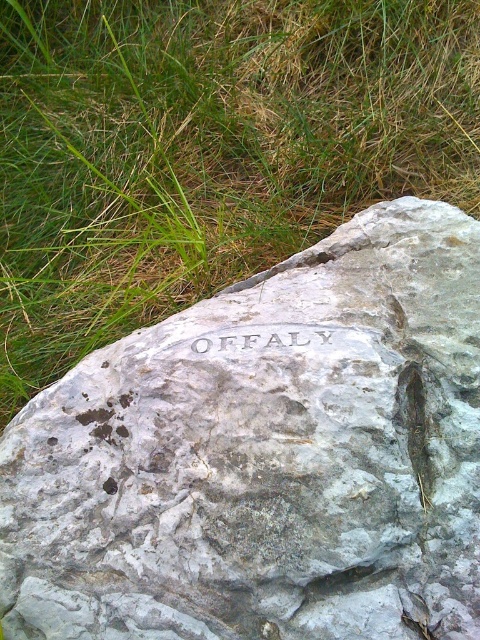
Does gray stone boulder at center appear on the right side of green grass at upper left?

Yes, gray stone boulder at center is to the right of green grass at upper left.

Looking at this image, how much distance is there between gray stone boulder at center and green grass at upper left?

gray stone boulder at center and green grass at upper left are 23.72 inches apart from each other.

The height and width of the screenshot is (640, 480). What are the coordinates of `gray stone boulder at center` in the screenshot? It's located at (265, 458).

Does green grass at upper left have a smaller size compared to gray stone engraving at center?

Actually, green grass at upper left might be larger than gray stone engraving at center.

Which of these two, green grass at upper left or gray stone engraving at center, stands taller?

green grass at upper left is taller.

Does point (22, 179) come behind point (267, 337)?

Yes, it is.

Where is `green grass at upper left`? This screenshot has width=480, height=640. green grass at upper left is located at coordinates (206, 148).

Does gray stone boulder at center lie behind gray stone engraving at center?

No.

Does gray stone boulder at center have a smaller size compared to gray stone engraving at center?

Actually, gray stone boulder at center might be larger than gray stone engraving at center.

The height and width of the screenshot is (640, 480). Identify the location of gray stone boulder at center. (265, 458).

Locate an element on the screen. This screenshot has width=480, height=640. gray stone boulder at center is located at coordinates (265, 458).